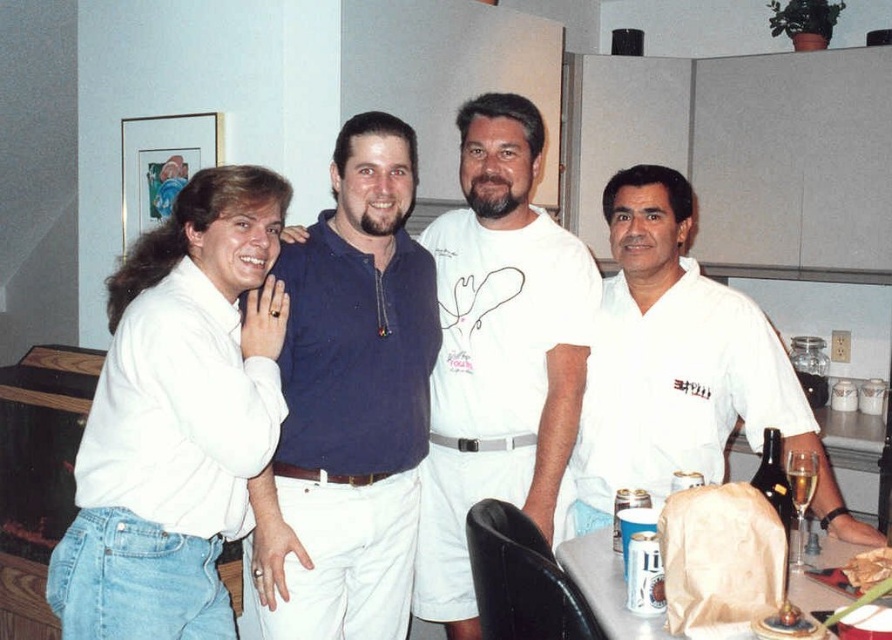
Question: Is white matte shirt at left bigger than white paper bag at lower center?

Choices:
 (A) yes
 (B) no

Answer: (A)

Question: Which point appears farthest from the camera in this image?

Choices:
 (A) (197, 593)
 (B) (621, 609)

Answer: (A)

Question: Can you confirm if white matte shirt at left is smaller than matte blue polo shirt at center?

Choices:
 (A) no
 (B) yes

Answer: (B)

Question: In this image, where is matte blue polo shirt at center located relative to blue cotton polo shirt at center?

Choices:
 (A) below
 (B) above

Answer: (B)

Question: Which of the following is the closest to the observer?

Choices:
 (A) white cotton shirt at center
 (B) matte blue polo shirt at center

Answer: (A)

Question: Which object appears closest to the camera in this image?

Choices:
 (A) white paper bag at lower center
 (B) white cotton shirt at center
 (C) white matte shirt at left

Answer: (A)